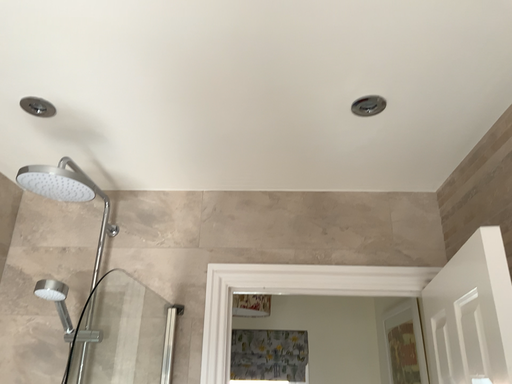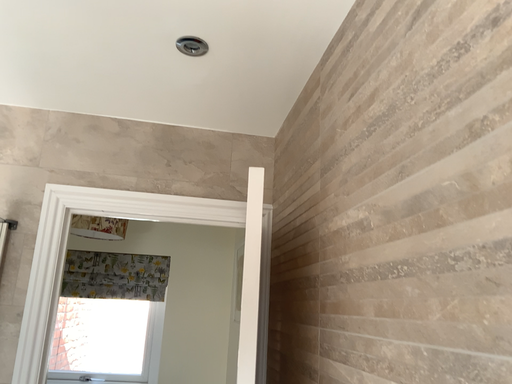
Question: How did the camera likely rotate when shooting the video?

Choices:
 (A) rotated left
 (B) rotated right

Answer: (B)